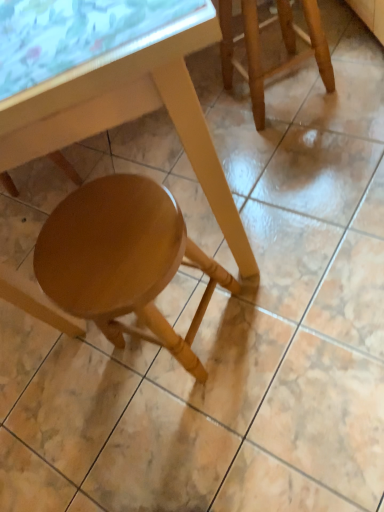
Where is `free space that is to the left of glossy wood stool at lower center, which is counted as the 2th stool, starting from the right`? The width and height of the screenshot is (384, 512). free space that is to the left of glossy wood stool at lower center, which is counted as the 2th stool, starting from the right is located at coordinates (60, 400).